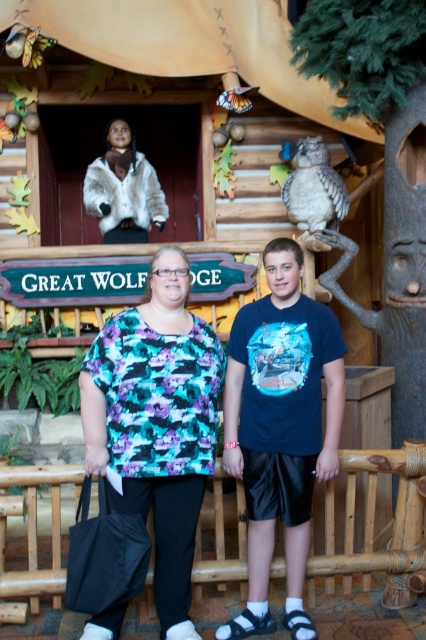
You are standing in the rustic cabin themed area and want to move from point A to point B. Point A is at coordinate point (178, 291) and point B is at coordinate point (287, 429). Which point is closer to you?

Point A at coordinate point (178, 291) is closer to you than point B at coordinate point (287, 429).

You are a photographer positioned at the center of the scene. You want to capture a photo that includes both the printed fabric blouse at center and the gray feathered owl at upper right. Given that your camera has a focal length of 50mm and the owl is 8.71 feet away from the blouse, can you frame both subjects in a single shot without moving either?

The printed fabric blouse at center and gray feathered owl at upper right are 8.71 feet apart. With a 50mm lens, which has a moderate field of view, it should be possible to include both in the frame if you position yourself appropriately. However, exact framing depends on your distance from the subjects and the camera sensor size. Since the separation is about 8.71 feet, a standard lens like 50mm can likely accommodate this distance without needing to move the subjects.